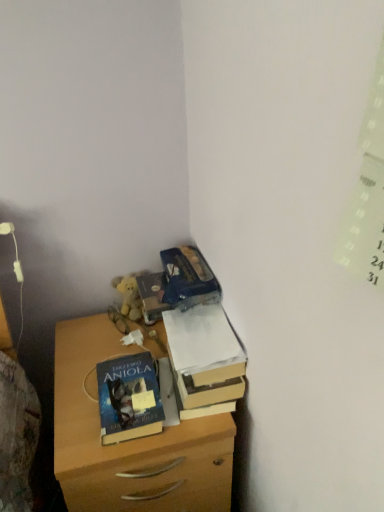
Question: In terms of height, does blue matte book at center look taller or shorter compared to wooden chest of drawers at lower left?

Choices:
 (A) tall
 (B) short

Answer: (B)

Question: Is blue matte book at center inside or outside of wooden chest of drawers at lower left?

Choices:
 (A) inside
 (B) outside

Answer: (B)

Question: Based on their relative distances, which object is nearer to the wooden chest of drawers at lower left?

Choices:
 (A) cardboard box at upper right
 (B) blue matte book at center

Answer: (B)

Question: Considering the real-world distances, which object is farthest from the blue matte book at center?

Choices:
 (A) cardboard box at upper right
 (B) wooden chest of drawers at lower left

Answer: (A)